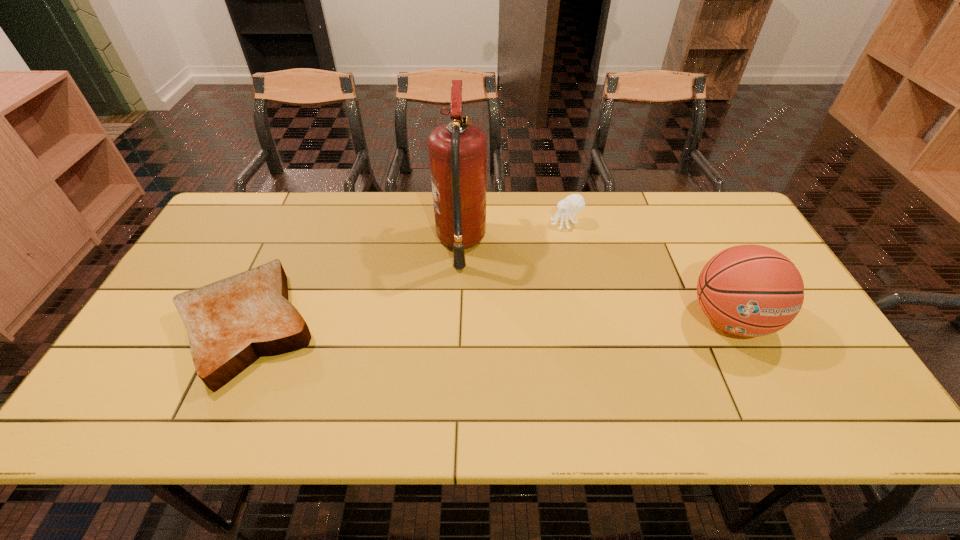
What are the coordinates of `vacant region at the far edge of the desktop` in the screenshot? It's located at (550, 200).

In the image, there is a desktop. What are the coordinates of `vacant space at the near edge` in the screenshot? It's located at (222, 394).

This screenshot has width=960, height=540. In the image, there is a desktop. What are the coordinates of `vacant space at the left edge` in the screenshot? It's located at (178, 312).

Locate an element on the screen. The image size is (960, 540). free location at the right edge is located at coordinates (804, 314).

Where is `vacant region between the second object from right to left and the tallest object`? vacant region between the second object from right to left and the tallest object is located at coordinates (514, 233).

This screenshot has width=960, height=540. What are the coordinates of `vacant point located between the rightmost object and the third object from left to right` in the screenshot? It's located at (648, 271).

Locate an element on the screen. The width and height of the screenshot is (960, 540). free space between the fire extinguisher and the octopus is located at coordinates (514, 233).

Identify the location of unoccupied position between the bread and the tallest object. The width and height of the screenshot is (960, 540). (353, 285).

You are a GUI agent. You are given a task and a screenshot of the screen. Output one action in this format:
    pyautogui.click(x=<x>, y=<y>)
    Task: Click on the free spot between the rightmost object and the shortest object
    
    Given the screenshot: What is the action you would take?
    pyautogui.click(x=488, y=323)

At what (x,y) coordinates should I click in order to perform the action: click on empty space that is in between the third tallest object and the tallest object. Please return your answer as a coordinate pair (x, y). Looking at the image, I should click on (514, 233).